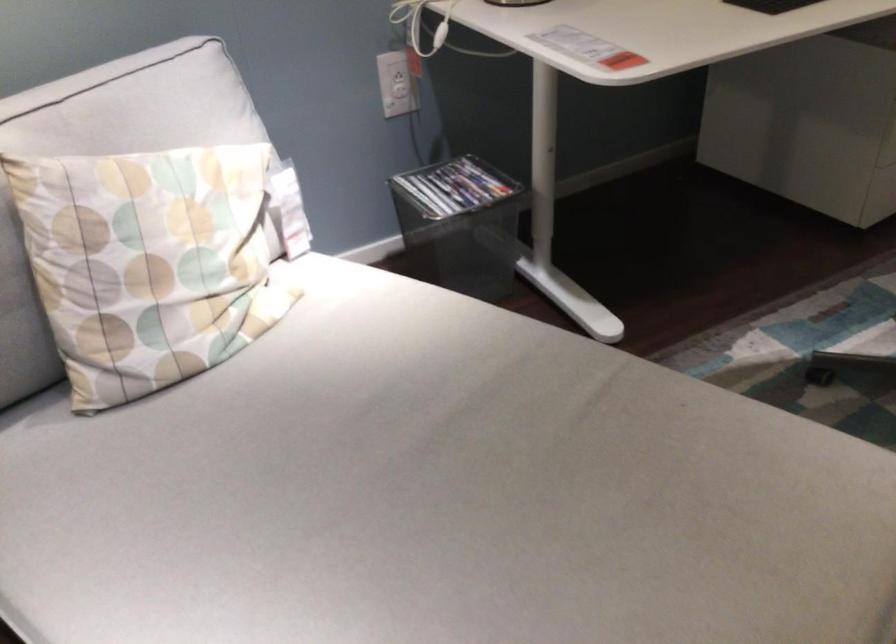
The height and width of the screenshot is (644, 896). What do you see at coordinates (398, 77) in the screenshot?
I see `the white outlet switch` at bounding box center [398, 77].